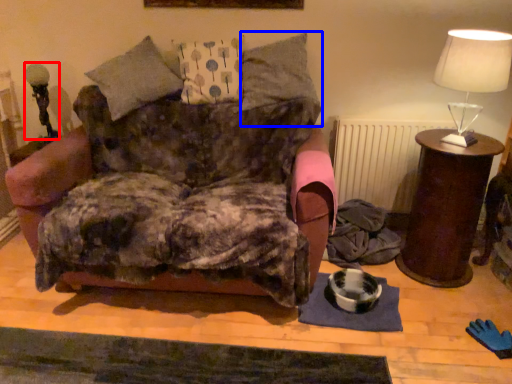
Question: Which point is closer to the camera, table lamp (highlighted by a red box) or pillow (highlighted by a blue box)?

Choices:
 (A) table lamp
 (B) pillow

Answer: (B)